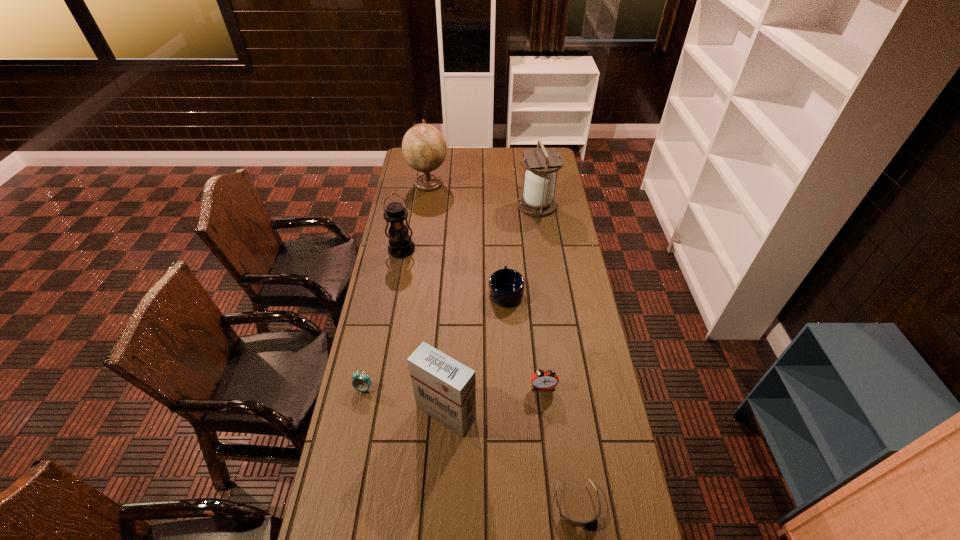
Locate an element on the screen. object at the far edge is located at coordinates (424, 148).

Identify the location of globe situated at the left edge. The width and height of the screenshot is (960, 540). (424, 148).

This screenshot has height=540, width=960. Identify the location of lantern located at the left edge. pyautogui.click(x=401, y=245).

Locate an element on the screen. alarm clock located in the left edge section of the desktop is located at coordinates (361, 382).

Identify the location of lantern situated at the right edge. (538, 200).

Where is `goggles present at the right edge`? goggles present at the right edge is located at coordinates (576, 523).

I want to click on object that is at the far left corner, so (x=424, y=148).

This screenshot has width=960, height=540. In the image, there is a desktop. Identify the location of vacant space at the left edge. point(405,180).

I want to click on vacant region at the right edge of the desktop, so click(578, 375).

This screenshot has width=960, height=540. Identify the location of free space between the globe and the nearer lantern. (415, 216).